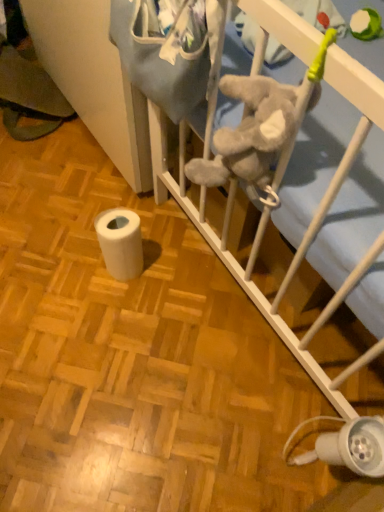
Find the location of a particular element. free space above white soft infant bed at center (from a real-world perspective) is located at coordinates (92, 265).